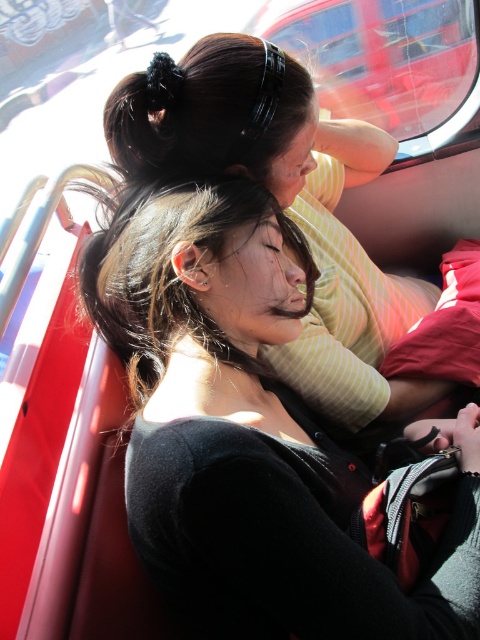
You are a photographer trying to capture a candid shot of the two people with black matte hair at center and black matte hair at upper center in the bus. The camera you have can only focus on subjects within a 10 inch range. Will both subjects be in focus?

The distance between black matte hair at center and black matte hair at upper center is 10.58 inches, which exceeds the camera focus range of 10 inches. Therefore, both subjects cannot be in focus simultaneously.

You are a passenger on a bus and want to place a small bag on the seat between the two people. The seat has a coordinate system where the bottom left corner is the origin. The black matte hair at center is located at point [248,433]. Where should you place the bag to avoid both people?

Place the bag at a coordinate lower than 0.517 in the y axis to avoid the black matte hair at center located at [248,433] and the person behind them.

You are a passenger on a bus and you see the black matte hair at center. Where is it located in terms of coordinates?

The black matte hair at center is located at coordinates point (248, 433).